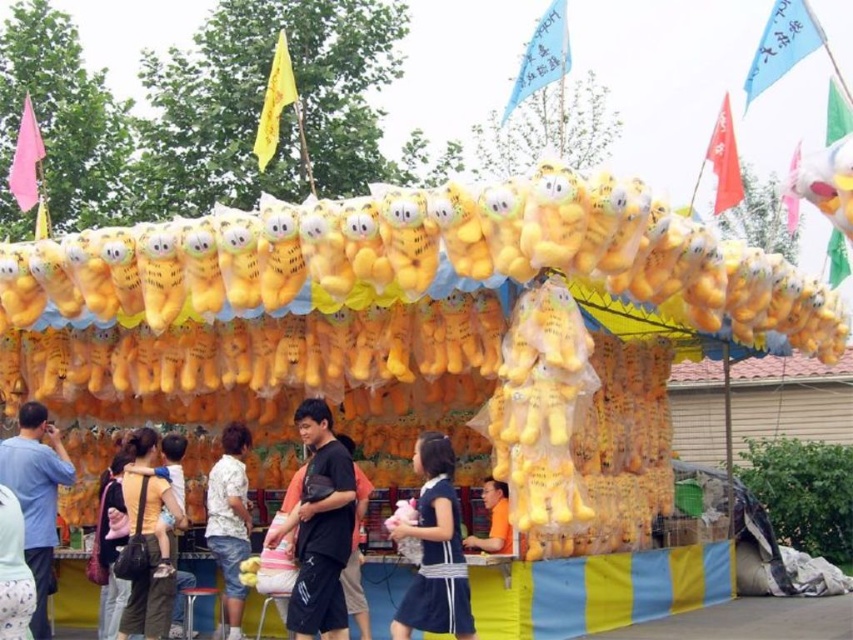
Question: Is blue cotton shirt at left to the left of orange matte shirt at center from the viewer's perspective?

Choices:
 (A) no
 (B) yes

Answer: (B)

Question: Which of the following is the closest to the observer?

Choices:
 (A) matte yellow plush toy at lower left
 (B) black cotton shirt at center
 (C) blue cotton shirt at left
 (D) dark blue cotton dress at center

Answer: (D)

Question: Which point is farther to the camera?

Choices:
 (A) (224, 612)
 (B) (450, 456)
 (C) (502, 230)
 (D) (131, 481)

Answer: (A)

Question: Where is yellow plush toy at center located in relation to dark blue cotton dress at center in the image?

Choices:
 (A) left
 (B) right

Answer: (B)

Question: Is dark blue cotton dress at center to the left of white cotton shirt at center from the viewer's perspective?

Choices:
 (A) yes
 (B) no

Answer: (B)

Question: Which is farther from the blue cotton shirt at left?

Choices:
 (A) yellow plush toy at center
 (B) orange matte shirt at center

Answer: (A)